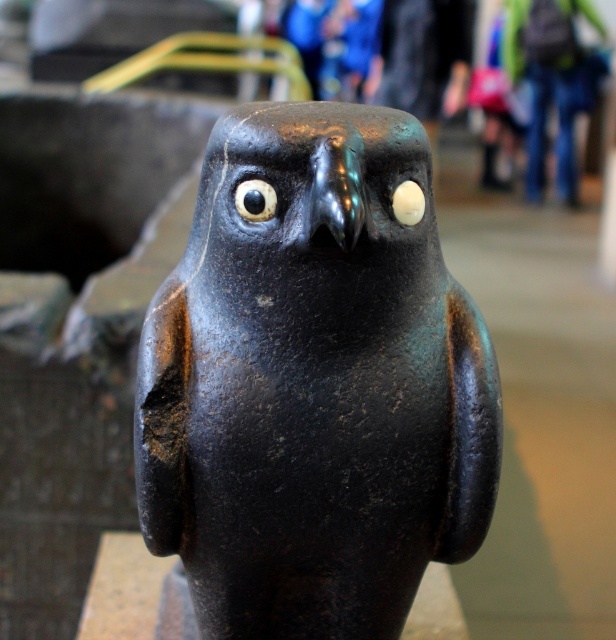
Is jeans at center taller than black glossy eye at center?

Yes.

Who is more forward, (565, 177) or (248, 204)?

Positioned in front is point (248, 204).

At what (x,y) coordinates should I click in order to perform the action: click on jeans at center. Please return your answer as a coordinate pair (x, y). This screenshot has height=640, width=616. Looking at the image, I should click on (548, 81).

Between matte black bird at center and black glossy eye at center, which one is positioned lower?

Positioned lower is matte black bird at center.

Is matte black bird at center to the right of black glossy eye at center from the viewer's perspective?

Correct, you'll find matte black bird at center to the right of black glossy eye at center.

This screenshot has height=640, width=616. Find the location of `matte black bird at center`. matte black bird at center is located at coordinates (312, 385).

The image size is (616, 640). What are the coordinates of `matte black bird at center` in the screenshot? It's located at (312, 385).

Which is in front, point (206, 580) or point (546, 93)?

Point (206, 580)

Does matte black bird at center have a smaller size compared to jeans at center?

No.

Does point (168, 436) lie behind point (554, 28)?

No, it is not.

Where is `matte black bird at center`? The width and height of the screenshot is (616, 640). matte black bird at center is located at coordinates tap(312, 385).